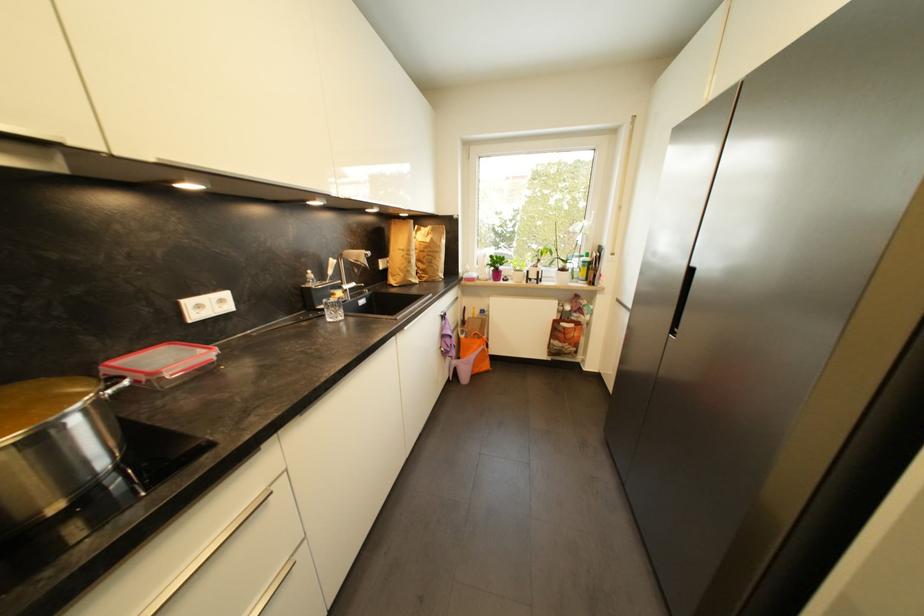
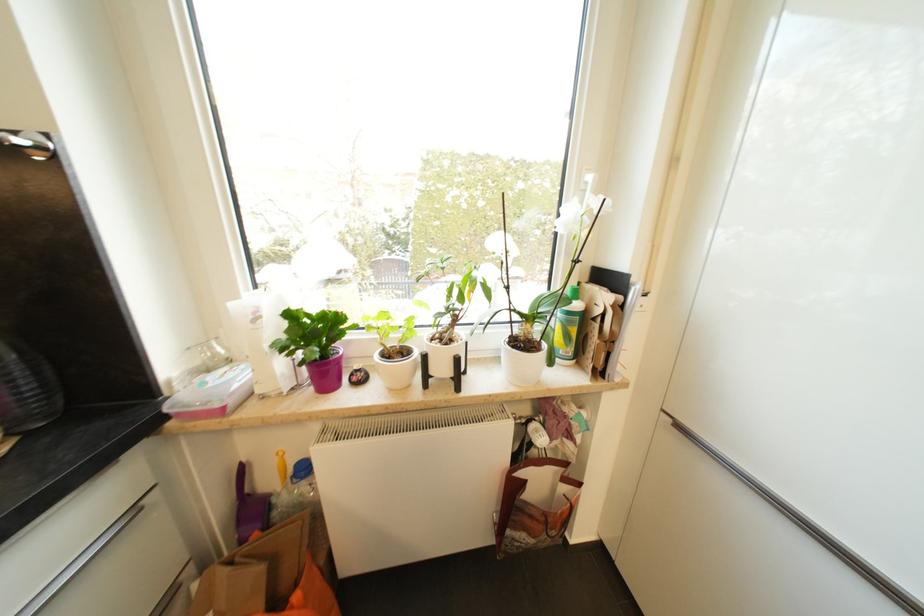
Where in the second image is the point corresponding to pixel 589 264 from the first image?

(574, 315)